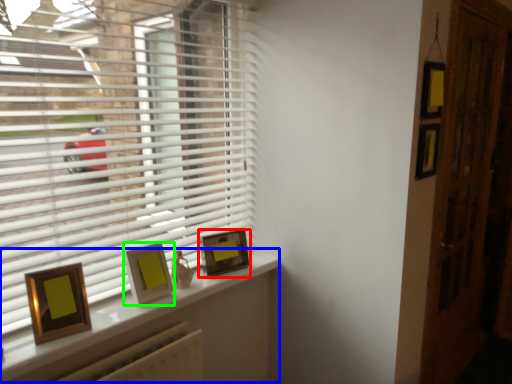
Question: Estimate the real-world distances between objects in this image. Which object is closer to picture frame (highlighted by a red box), window (highlighted by a blue box) or picture frame (highlighted by a green box)?

Choices:
 (A) window
 (B) picture frame

Answer: (A)